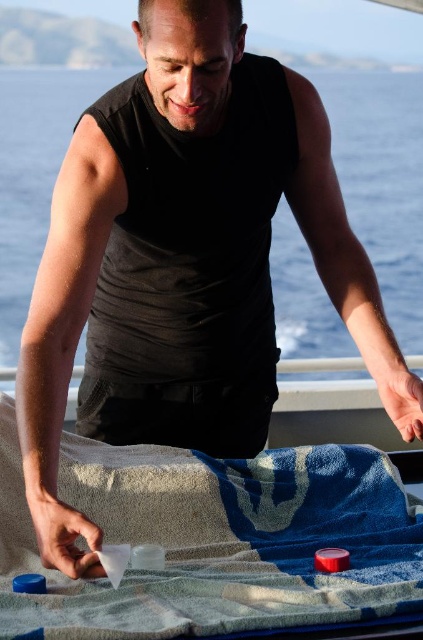
Question: Which of the following is the farthest from the observer?

Choices:
 (A) black matte towel at lower center
 (B) blue textured towel at lower center

Answer: (A)

Question: Can you confirm if blue textured towel at lower center is bigger than black matte towel at lower center?

Choices:
 (A) no
 (B) yes

Answer: (A)

Question: Is blue textured towel at lower center bigger than black matte towel at lower center?

Choices:
 (A) yes
 (B) no

Answer: (B)

Question: Is blue textured towel at lower center above black matte towel at lower center?

Choices:
 (A) yes
 (B) no

Answer: (B)

Question: Among these points, which one is nearest to the camera?

Choices:
 (A) (255, 515)
 (B) (420, 228)

Answer: (A)